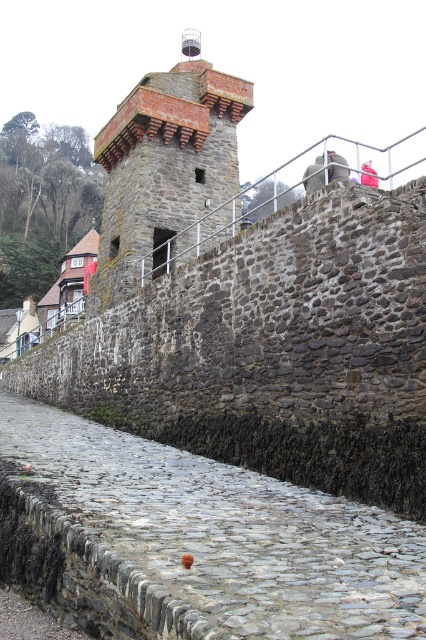
Question: Does cobblestone at lower center appear over rustic stone tower at center?

Choices:
 (A) no
 (B) yes

Answer: (A)

Question: Which of the following is the farthest from the observer?

Choices:
 (A) rustic stone tower at center
 (B) cobblestone at lower center

Answer: (A)

Question: Considering the relative positions of cobblestone at lower center and rustic stone tower at center in the image provided, where is cobblestone at lower center located with respect to rustic stone tower at center?

Choices:
 (A) below
 (B) above

Answer: (A)

Question: Can you confirm if cobblestone at lower center is positioned below rustic stone tower at center?

Choices:
 (A) yes
 (B) no

Answer: (A)

Question: Which object appears farthest from the camera in this image?

Choices:
 (A) cobblestone at lower center
 (B) rustic stone tower at center

Answer: (B)